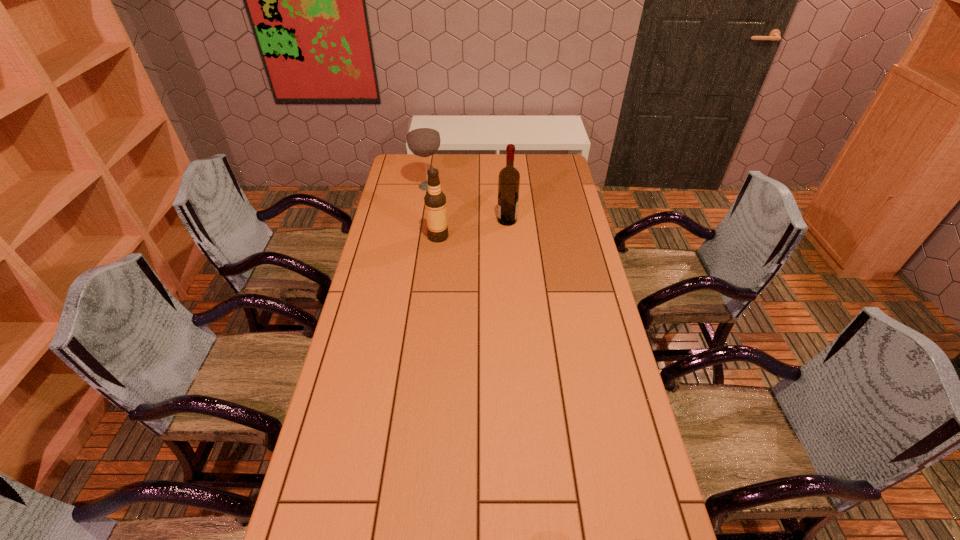
In order to click on object at the left edge in this screenshot , I will do `click(423, 139)`.

What are the coordinates of `object located in the far left corner section of the desktop` in the screenshot? It's located at (423, 139).

You are a GUI agent. You are given a task and a screenshot of the screen. Output one action in this format:
    pyautogui.click(x=<x>, y=<y>)
    Task: Click on the vacant region at the left edge
    The width and height of the screenshot is (960, 540).
    Given the screenshot: What is the action you would take?
    pyautogui.click(x=390, y=266)

Where is `vacant position at the right edge of the desktop`? The height and width of the screenshot is (540, 960). vacant position at the right edge of the desktop is located at coordinates (596, 281).

Find the location of a particular element. vacant space at the far left corner of the desktop is located at coordinates (417, 172).

Where is `vacant space that is in between the rightmost object and the farthest object`? The height and width of the screenshot is (540, 960). vacant space that is in between the rightmost object and the farthest object is located at coordinates (468, 203).

Where is `object that is the second closest one to the nearest alcohol`? The image size is (960, 540). object that is the second closest one to the nearest alcohol is located at coordinates (423, 139).

Select which object is the closest to the farthest object. Please provide its 2D coordinates. Your answer should be formatted as a tuple, i.e. [(x, y)], where the tuple contains the x and y coordinates of a point satisfying the conditions above.

[(435, 200)]

The height and width of the screenshot is (540, 960). Find the location of `the closest alcohol to the farthest object`. the closest alcohol to the farthest object is located at coordinates (435, 200).

Identify which alcohol is the second closest to the rightmost alcohol. Please provide its 2D coordinates. Your answer should be formatted as a tuple, i.e. [(x, y)], where the tuple contains the x and y coordinates of a point satisfying the conditions above.

[(423, 139)]